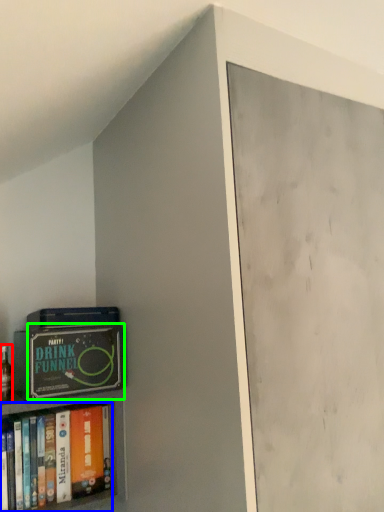
Question: Which is nearer to the alcohol (highlighted by a red box)? book (highlighted by a blue box) or paperback book (highlighted by a green box).

Choices:
 (A) book
 (B) paperback book

Answer: (A)